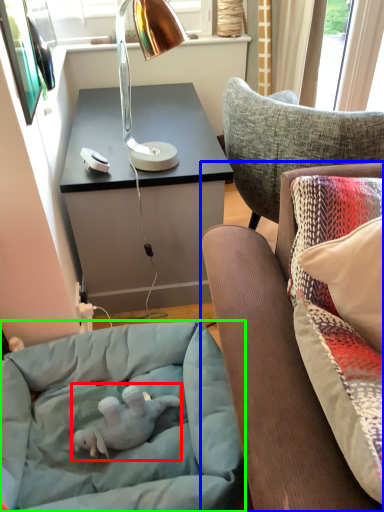
Question: Which object is positioned closest to baby elephant (highlighted by a red box)? Select from studio couch (highlighted by a blue box) and dog bed (highlighted by a green box).

Choices:
 (A) studio couch
 (B) dog bed

Answer: (B)